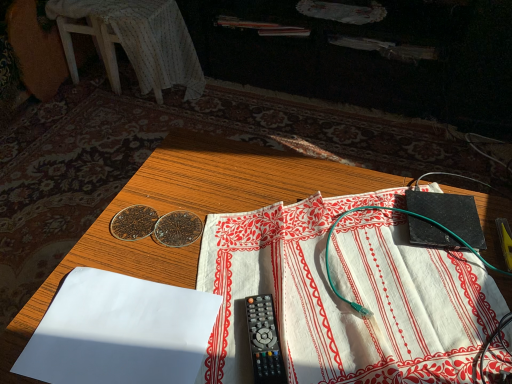
Locate an element on the screen. vacant space behind black plastic remote control at center is located at coordinates (265, 267).